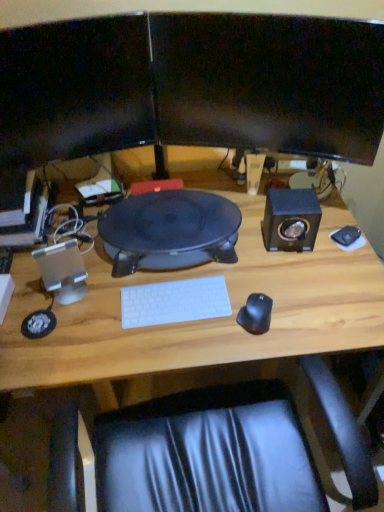
What are the coordinates of `free point behind black rubberized mouse at right, the 1th mouse when ordered from front to back` in the screenshot? It's located at (257, 275).